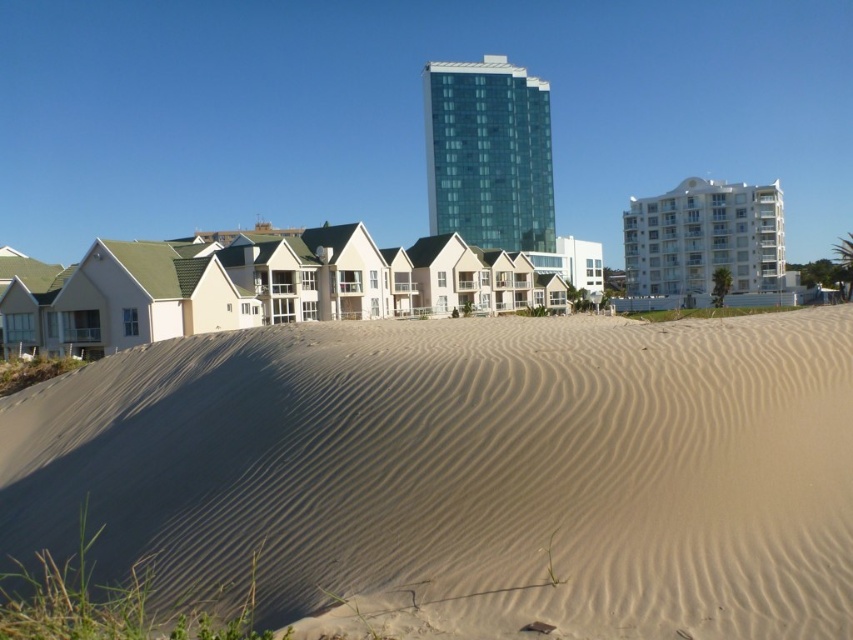
You are a photographer planning to capture the light beige sand at center and the white glossy building at upper right in a single shot. Based on their heights, which one will appear taller in the photo?

The white glossy building at upper right will appear taller in the photo because it is taller than the light beige sand at center.

You are standing in the coastal scene and want to determine which of the two points, point (335, 355) or point (368, 312), is closer to you. Based on the image, which point is nearer?

Point (335, 355) is closer to the camera than point (368, 312), so it is the nearer one.

You are a photographer planning to capture the white glossy building at upper right and the light beige sand at center in the same frame. Based on their positions, can you determine which one will appear closer to the bottom of the photo?

The light beige sand at center is positioned under the white glossy building at upper right, so in the photo, the light beige sand at center will appear closer to the bottom of the frame.